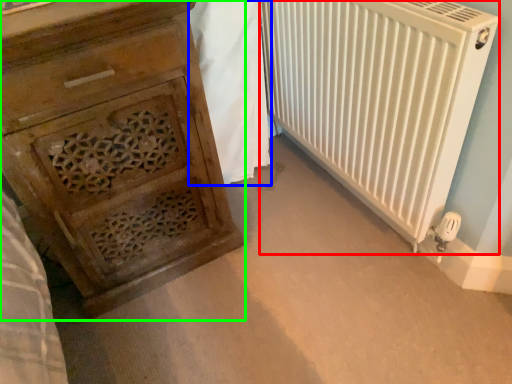
Question: Considering the real-world distances, which object is closest to radiator (highlighted by a red box)? blanket (highlighted by a blue box) or chest of drawers (highlighted by a green box).

Choices:
 (A) blanket
 (B) chest of drawers

Answer: (A)